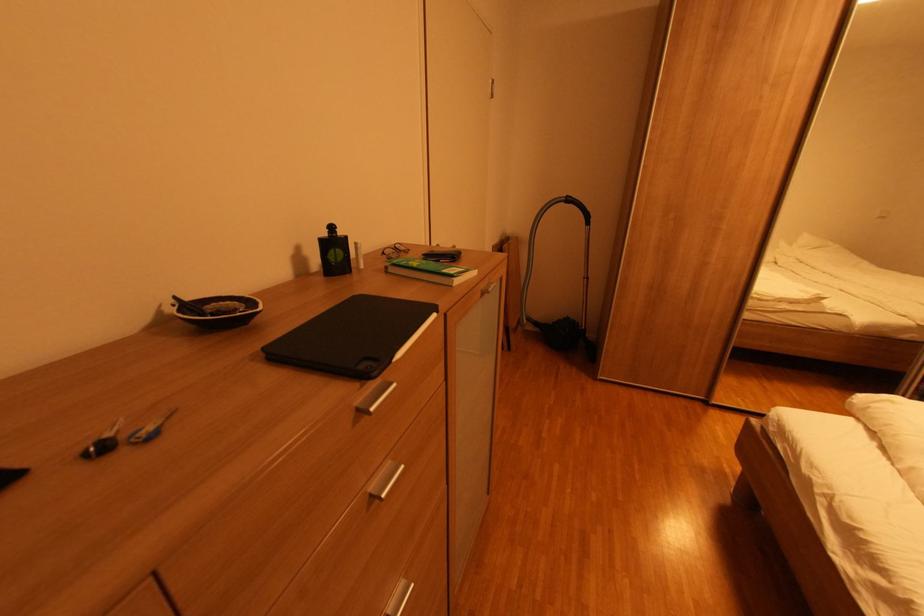
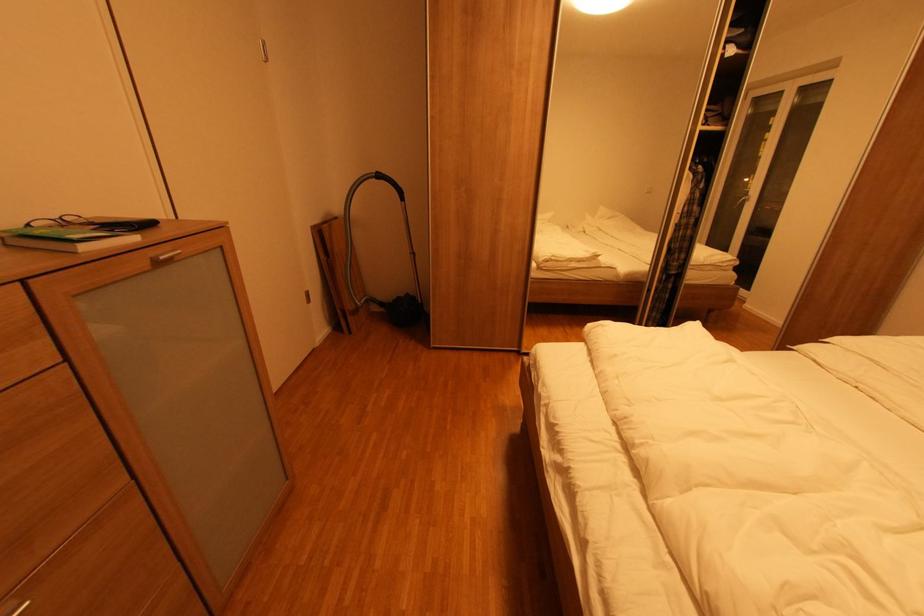
Locate, in the second image, the point that corresponds to (390,254) in the first image.

(35, 225)